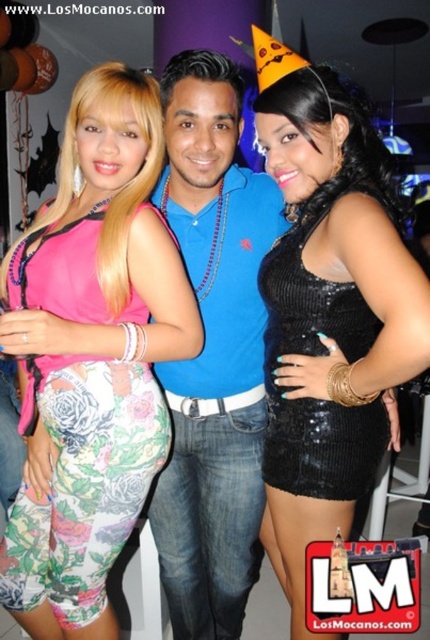
Does floral leggings at center come in front of black sequined dress at right?

That is True.

Who is lower down, floral leggings at center or black sequined dress at right?

floral leggings at center

You are a GUI agent. You are given a task and a screenshot of the screen. Output one action in this format:
    pyautogui.click(x=<x>, y=<y>)
    Task: Click on the floral leggings at center
    This screenshot has height=640, width=430.
    Given the screenshot: What is the action you would take?
    point(92,355)

Locate an element on the screen. This screenshot has height=640, width=430. floral leggings at center is located at coordinates (92, 355).

Does floral leggings at center have a greater height compared to black sequined dress at center?

No.

Is point (45, 616) closer to camera compared to point (282, 456)?

No, it is behind (282, 456).

Image resolution: width=430 pixels, height=640 pixels. What are the coordinates of `floral leggings at center` in the screenshot? It's located at (92, 355).

Does black sequined dress at center have a greater width compared to blue denim jeans at center?

No, black sequined dress at center is not wider than blue denim jeans at center.

Is point (279, 134) farther from camera compared to point (203, 99)?

No, (279, 134) is in front of (203, 99).

Between point (323, 182) and point (184, 220), which one is positioned behind?

The point (184, 220) is more distant.

Locate an element on the screen. The width and height of the screenshot is (430, 640). black sequined dress at center is located at coordinates (329, 316).